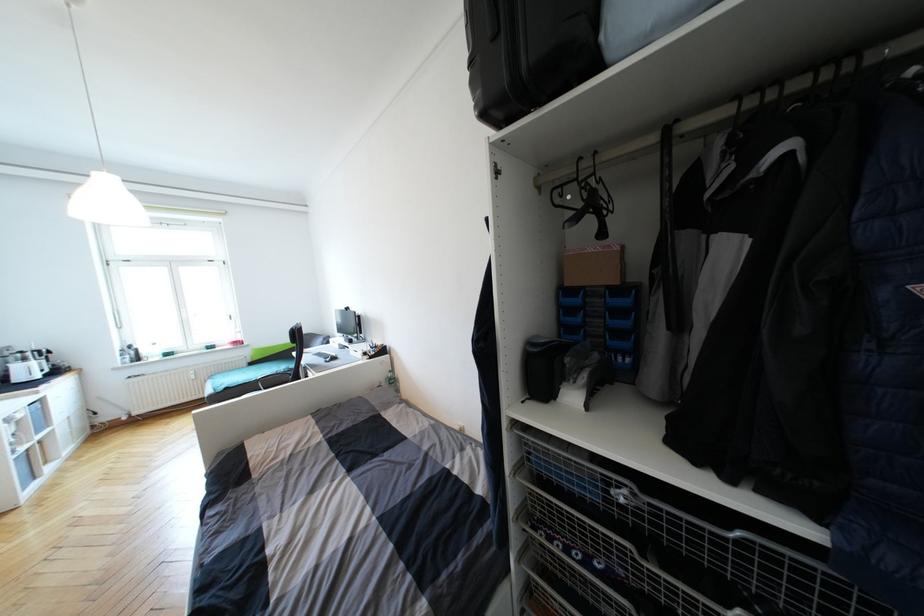
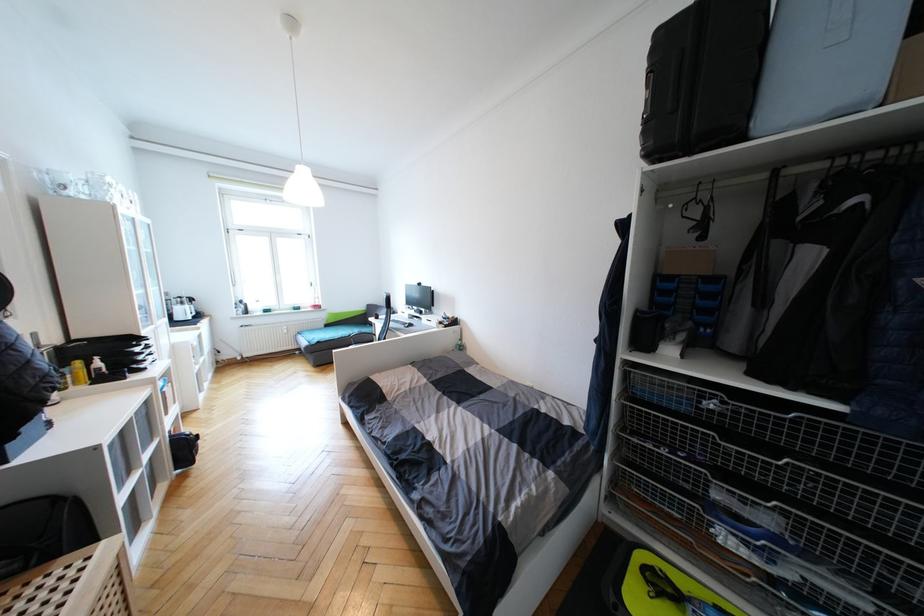
The point at (254, 365) is marked in the first image. Where is the corresponding point in the second image?

(331, 326)